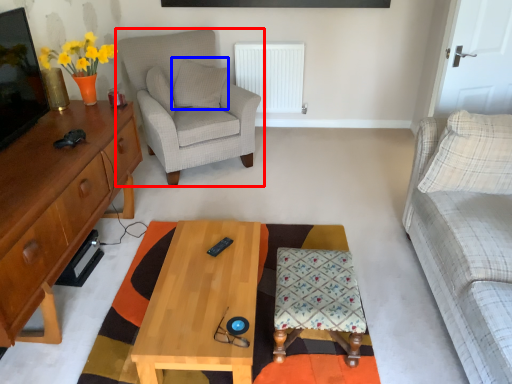
Question: Which of the following is the closest to the observer, chair (highlighted by a red box) or pillow (highlighted by a blue box)?

Choices:
 (A) chair
 (B) pillow

Answer: (A)